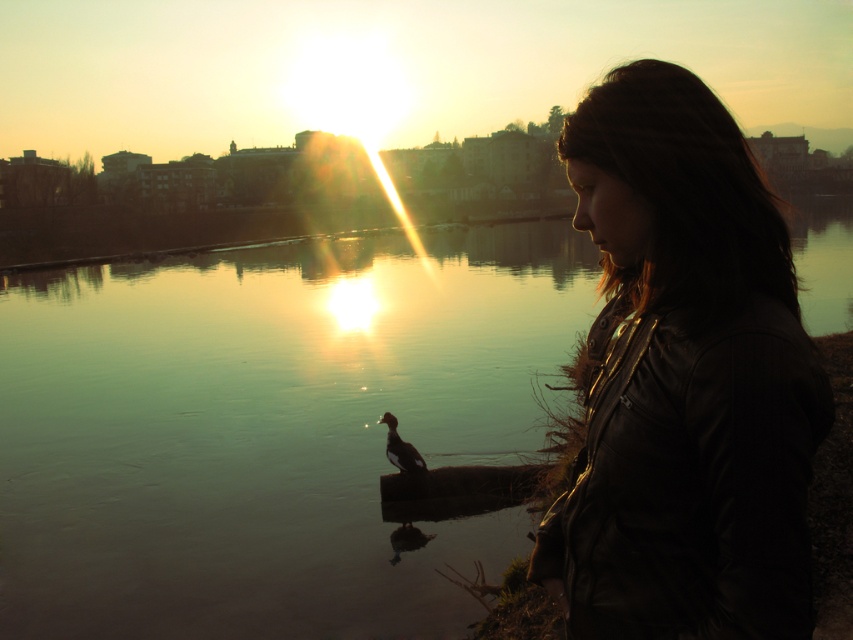
Question: Which object is the farthest from the greenish water at center?

Choices:
 (A) dark brown feathers at center
 (B) leather jacket at right

Answer: (B)

Question: Which point is farther from the camera taking this photo?

Choices:
 (A) (724, 118)
 (B) (395, 620)
 (C) (421, 470)

Answer: (C)

Question: Is greenish water at center wider than leather jacket at right?

Choices:
 (A) no
 (B) yes

Answer: (B)

Question: Which point is farther to the camera?

Choices:
 (A) (408, 464)
 (B) (695, 323)

Answer: (A)

Question: Is greenish water at center bigger than dark brown feathers at center?

Choices:
 (A) no
 (B) yes

Answer: (B)

Question: Does greenish water at center have a greater width compared to leather jacket at right?

Choices:
 (A) yes
 (B) no

Answer: (A)